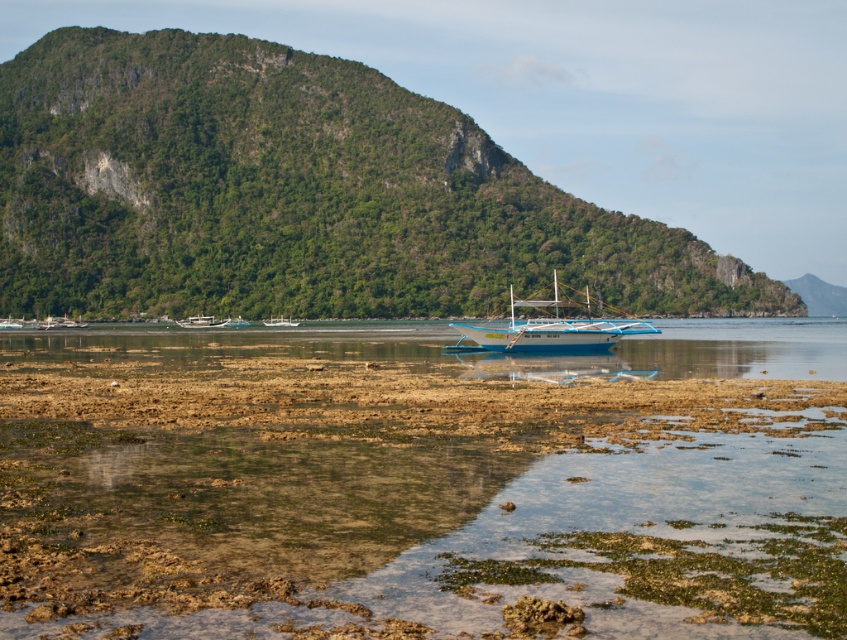
You are standing on the rocky shoreline and want to take a photo of the wooden boat at center and the green leafy mountain at right. Which object should you zoom in more on to capture both in the frame without cropping?

Since the green leafy mountain at right is larger than the wooden boat at center, you should zoom in more on the wooden boat at center to ensure both fit in the frame without cropping.

You are standing on the rocky shoreline and want to take a photo of both the green leafy mountain at right and the white glossy boat at center. Which object should you position closer to the edge of your camera frame to ensure both fit in the shot?

You should position the white glossy boat at center closer to the edge of your camera frame because the green leafy mountain at right might be wider than the boat, so centering the boat would allow more space for the wider mountain in the frame.

You are standing on the rocky shoreline and want to take a photo of the wooden boat at center with the green leafy mountain at right in the background. Based on their positions, will the mountain appear behind the boat in the photo?

The green leafy mountain at right is positioned over the wooden boat at center, so yes, the mountain will appear behind the boat in the photo.